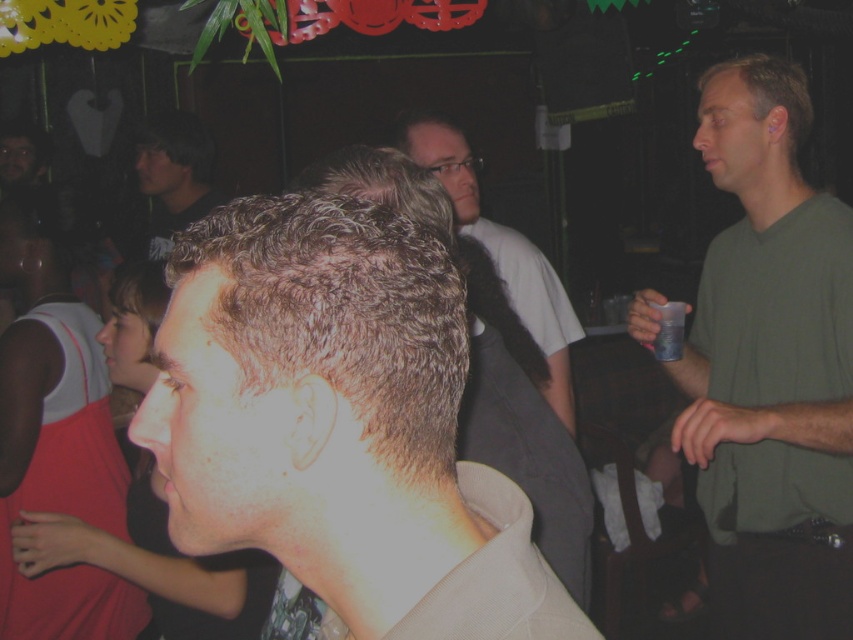
Based on the photo, can you confirm if light brown hair at center is taller than smooth skin face at center?

Incorrect, light brown hair at center's height is not larger of smooth skin face at center's.

Does light brown hair at center appear over smooth skin face at center?

Yes.

Which is behind, point (505, 602) or point (13, 429)?

The point (13, 429) is behind.

Where is `light brown hair at center`? This screenshot has height=640, width=853. light brown hair at center is located at coordinates (339, 422).

Can you confirm if smooth skin face at center is positioned above dark brown hair at upper left?

Incorrect, smooth skin face at center is not positioned above dark brown hair at upper left.

Who is taller, smooth skin face at center or dark brown hair at upper left?

smooth skin face at center

Identify the location of smooth skin face at center. (56, 435).

Between green matte shirt at right and dark brown hair at upper left, which one appears on the right side from the viewer's perspective?

green matte shirt at right is more to the right.

Is green matte shirt at right closer to the viewer compared to dark brown hair at upper left?

Yes, it is in front of dark brown hair at upper left.

Who is more distant from viewer, (782, 616) or (195, 196)?

Point (195, 196)

Where is `green matte shirt at right`? The width and height of the screenshot is (853, 640). green matte shirt at right is located at coordinates (770, 365).